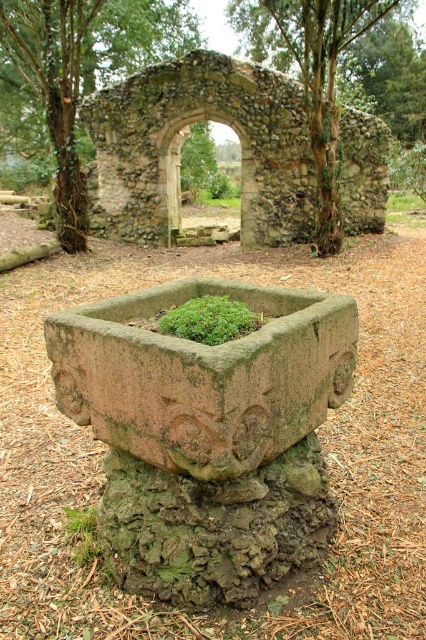
Question: In this image, where is green mossy stone at center located relative to green mossy stone arch at center?

Choices:
 (A) above
 (B) below

Answer: (B)

Question: Is green mossy stone at center positioned behind green mossy stone arch at center?

Choices:
 (A) no
 (B) yes

Answer: (B)

Question: Which point is farther to the camera?

Choices:
 (A) (9, 29)
 (B) (402, 116)

Answer: (B)

Question: Which point is farther to the camera?

Choices:
 (A) green mossy stone at center
 (B) green mossy stone arch at center

Answer: (A)

Question: Among these objects, which one is nearest to the camera?

Choices:
 (A) green mossy stone arch at center
 (B) green mossy stone at center

Answer: (A)

Question: Can you confirm if green mossy stone at center is positioned to the left of green mossy stone arch at center?

Choices:
 (A) yes
 (B) no

Answer: (A)